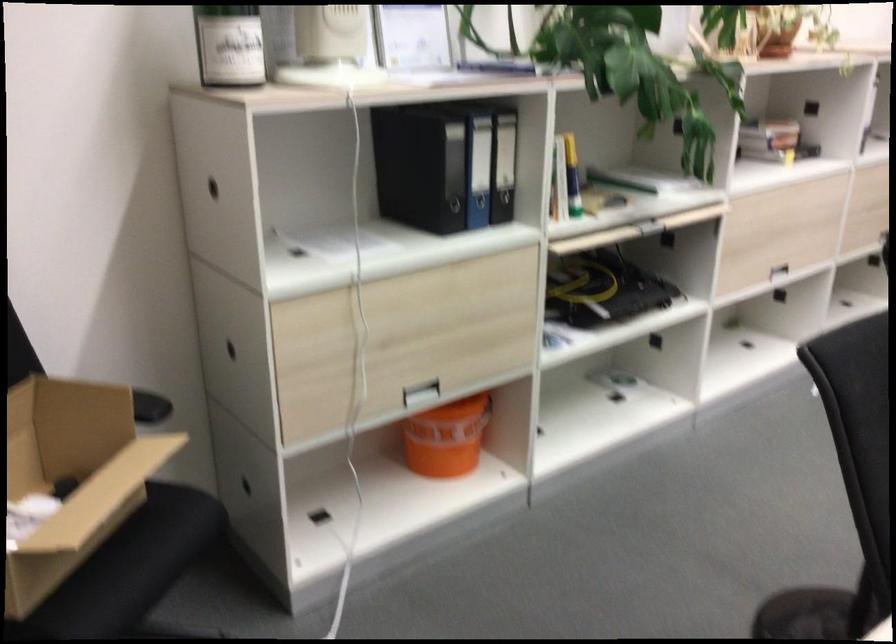
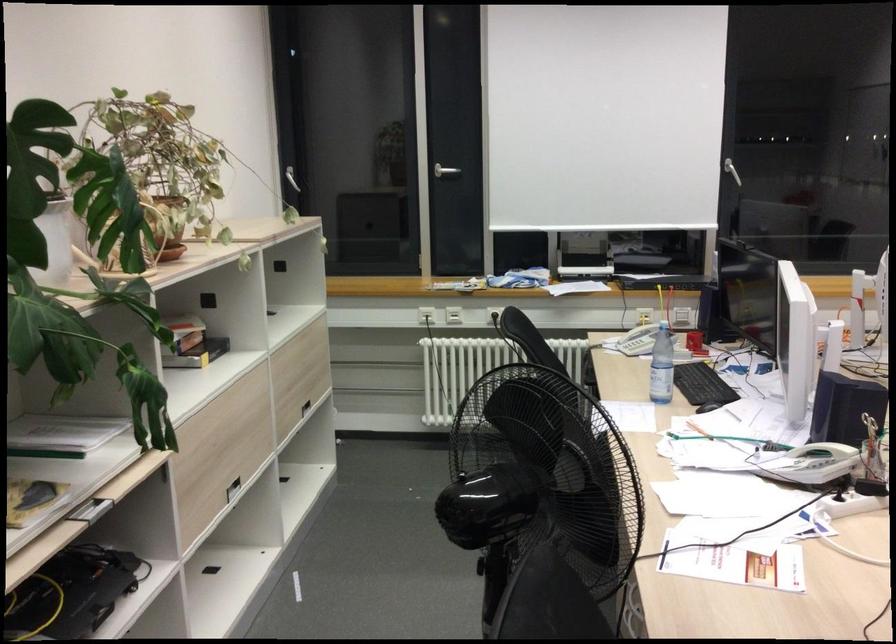
In the second image, find the point that corresponds to [771,221] in the first image.

(225, 435)